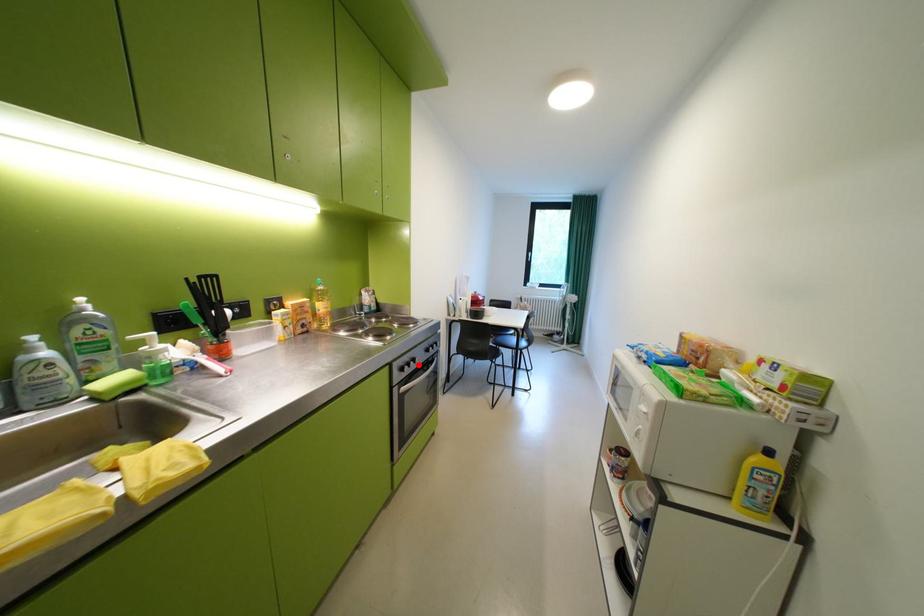
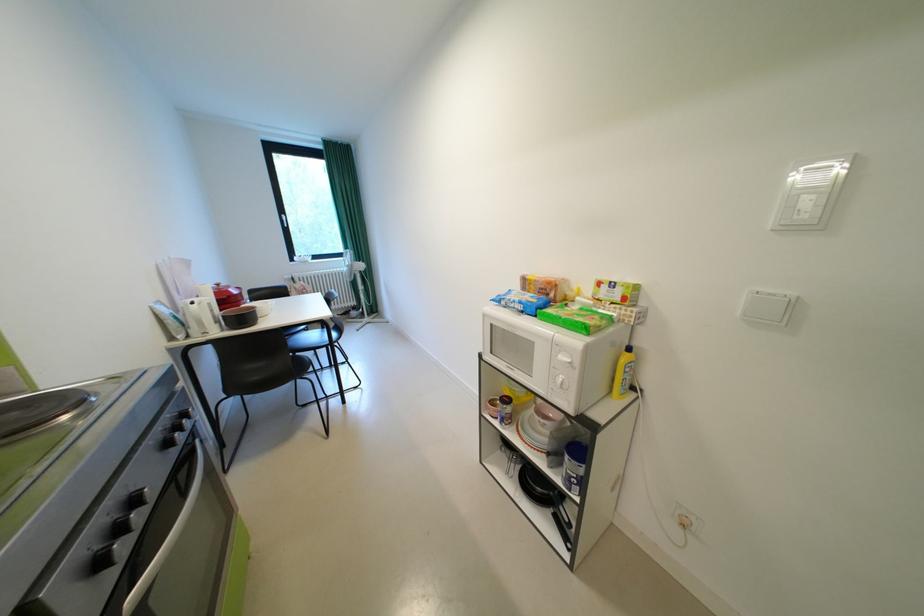
Find the pixel in the second image that matches the highlighted location in the first image.

(129, 531)